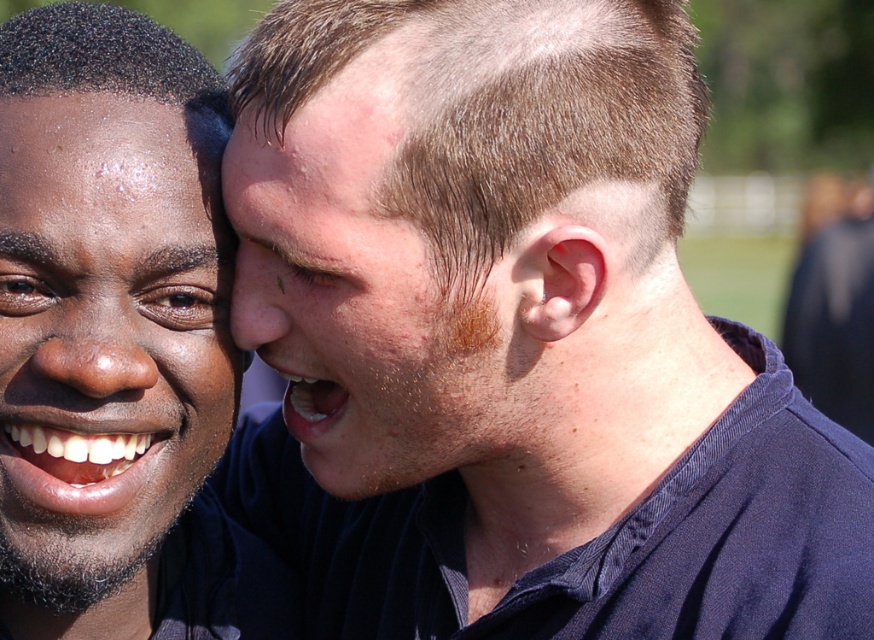
You are a photographer trying to capture the matte black face at left and the other person in the image. The camera can only focus on one point at a time. If you focus on point (106, 337), will the matte black face at left be in focus?

Yes, the matte black face at left will be in focus because point (106, 337) marks the matte black face at left.

You are standing in a park and see the matte black face at left. If you want to locate it precisely, what are its coordinates?

The coordinates of the matte black face at left are at point (x=106, y=337).